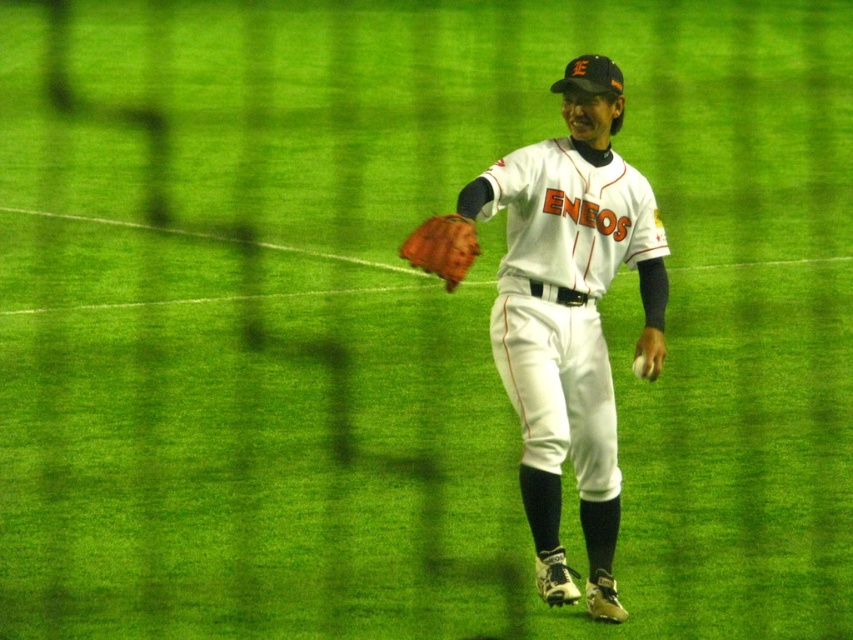
Question: Is white matte baseball glove at center above white matte baseball at center?

Choices:
 (A) no
 (B) yes

Answer: (B)

Question: Which object is positioned closest to the brown leather glove at center?

Choices:
 (A) white matte baseball glove at center
 (B) white matte baseball at center

Answer: (A)

Question: Which object appears closest to the camera in this image?

Choices:
 (A) white matte baseball glove at center
 (B) brown leather glove at center

Answer: (B)

Question: Is brown leather glove at center above white matte baseball at center?

Choices:
 (A) yes
 (B) no

Answer: (A)

Question: Does white matte baseball glove at center have a smaller size compared to white matte baseball at center?

Choices:
 (A) no
 (B) yes

Answer: (A)

Question: Among these objects, which one is farthest from the camera?

Choices:
 (A) brown leather glove at center
 (B) white matte baseball at center

Answer: (B)